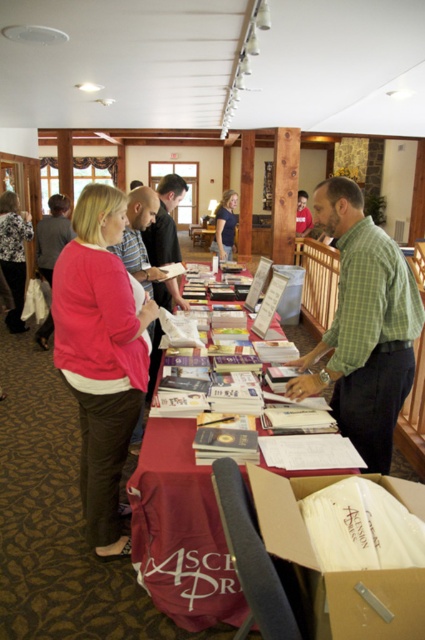
Is the position of floral-patterned blouse at center more distant than that of blue cotton shirt at center?

No, floral-patterned blouse at center is closer to the viewer.

Which is more to the left, floral-patterned blouse at center or blue cotton shirt at center?

floral-patterned blouse at center is more to the left.

Is point (23, 224) positioned behind point (221, 234)?

No, (23, 224) is closer to viewer.

Locate an element on the screen. Image resolution: width=425 pixels, height=640 pixels. floral-patterned blouse at center is located at coordinates (14, 253).

Does point (365, 401) come in front of point (226, 209)?

Yes, point (365, 401) is closer to viewer.

Between green checkered shirt at center and blue cotton shirt at center, which one has less height?

blue cotton shirt at center is shorter.

The width and height of the screenshot is (425, 640). What are the coordinates of `green checkered shirt at center` in the screenshot? It's located at (363, 326).

Is pink sweater at left behind blue cotton shirt at center?

No, it is not.

Which is in front, point (116, 433) or point (220, 216)?

Point (116, 433)

Find the location of a particular element. This screenshot has width=425, height=640. pink sweater at left is located at coordinates click(x=101, y=355).